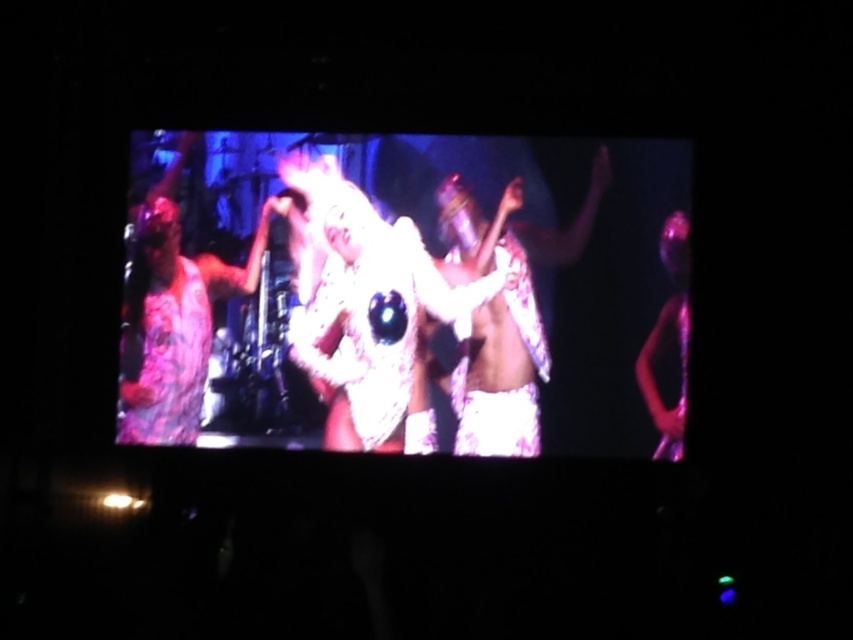
Question: In this image, where is white fluffy costume at center located relative to purple iridescent figure at right?

Choices:
 (A) below
 (B) above

Answer: (B)

Question: Which object is farther from the camera taking this photo?

Choices:
 (A) purple iridescent figure at right
 (B) white fluffy costume at center

Answer: (B)

Question: Does white fluffy costume at center lie behind purple iridescent figure at right?

Choices:
 (A) no
 (B) yes

Answer: (B)

Question: Which point is closer to the camera?

Choices:
 (A) purple iridescent figure at right
 (B) white fluffy costume at center

Answer: (A)

Question: Can you confirm if white fluffy costume at center is positioned below purple iridescent figure at right?

Choices:
 (A) yes
 (B) no

Answer: (B)